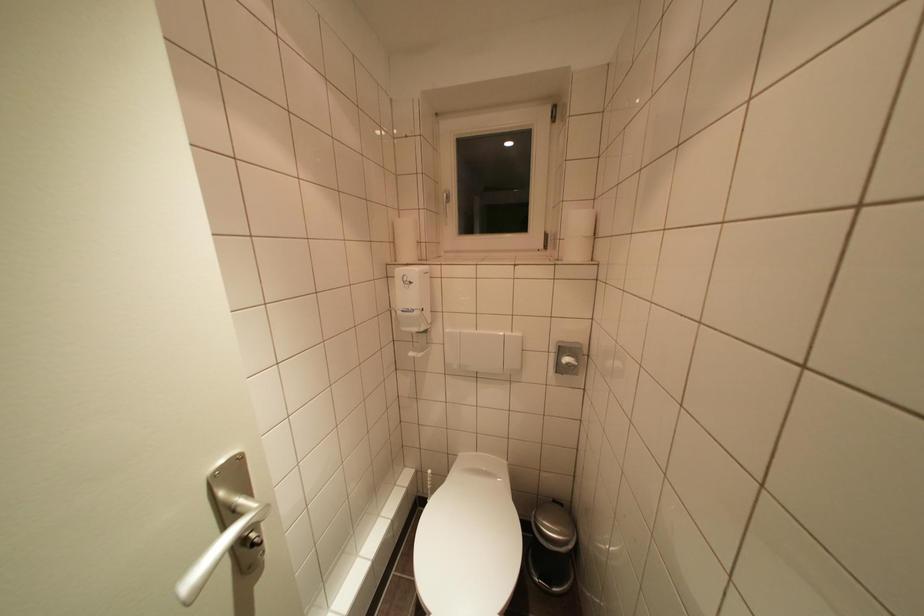
Where would you push the dispenser lever? Please return your answer as a coordinate pair (x, y).

(409, 315)